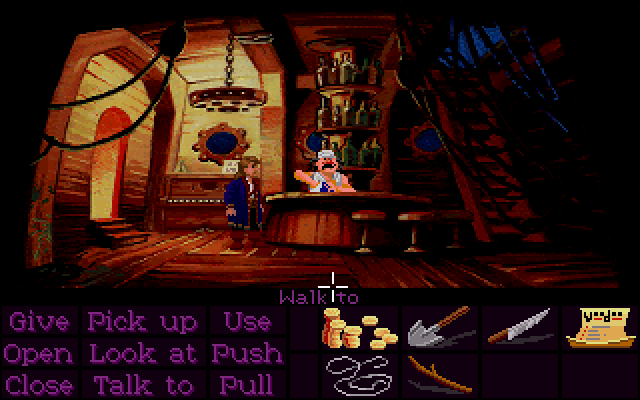
Where is `bar`? The height and width of the screenshot is (400, 640). bar is located at coordinates [x=317, y=210].